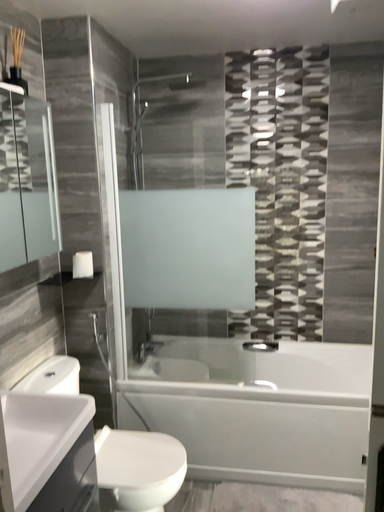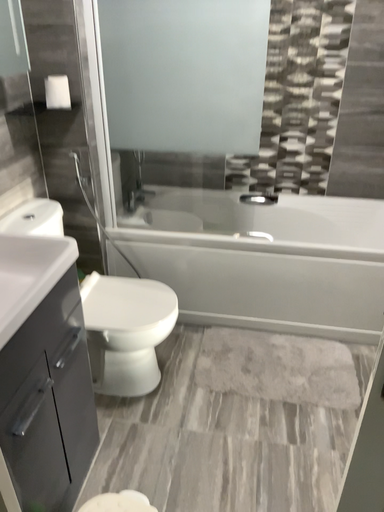
Question: How did the camera likely rotate when shooting the video?

Choices:
 (A) rotated upward
 (B) rotated downward

Answer: (B)